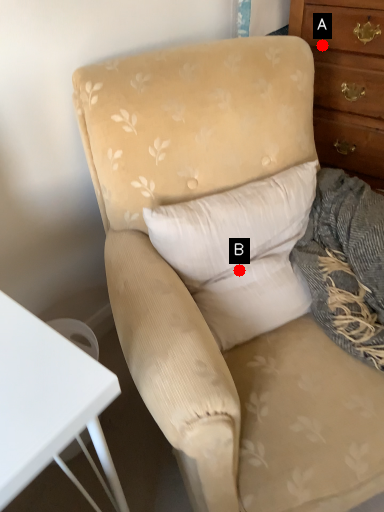
Question: Two points are circled on the image, labeled by A and B beside each circle. Which point is closer to the camera?

Choices:
 (A) A is closer
 (B) B is closer

Answer: (B)